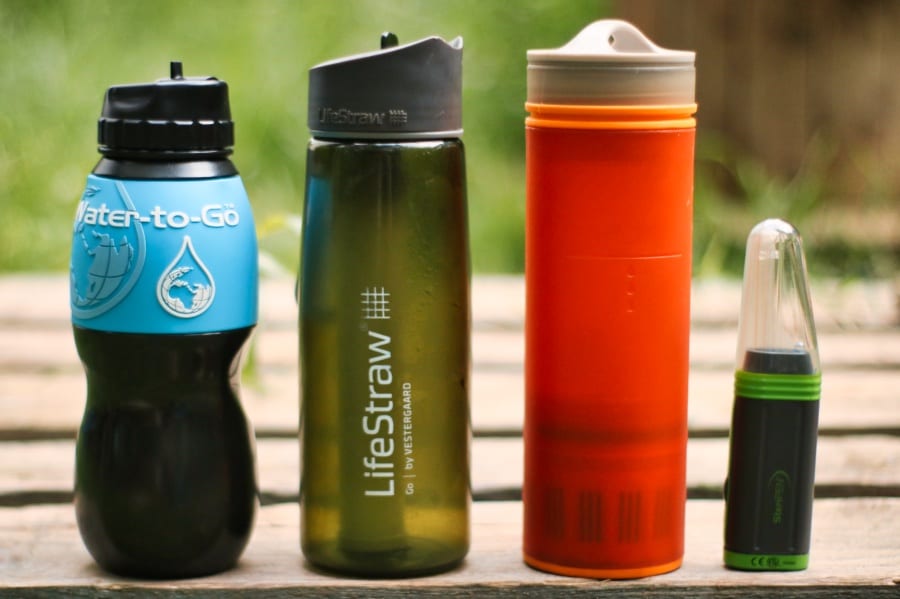
The height and width of the screenshot is (599, 900). Find the location of `drinking bottles`. drinking bottles is located at coordinates (774, 435), (643, 228), (401, 250), (186, 444).